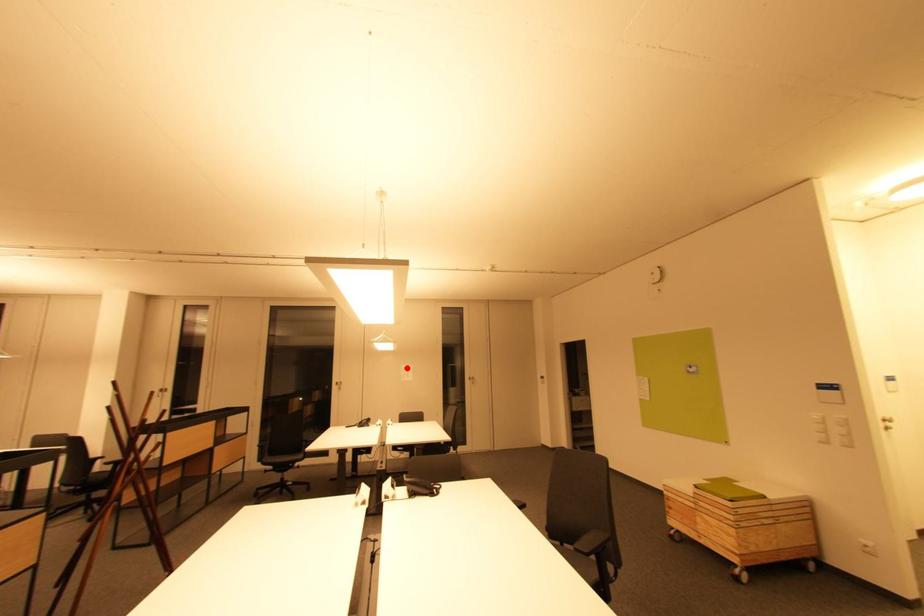
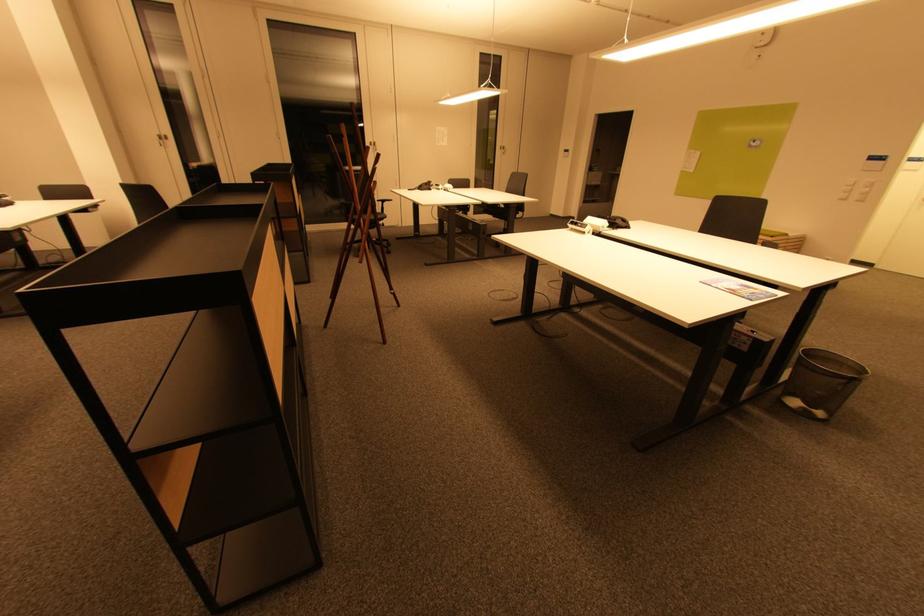
Where in the second image is the point corresponding to the highlighted location from the first image?

(442, 130)